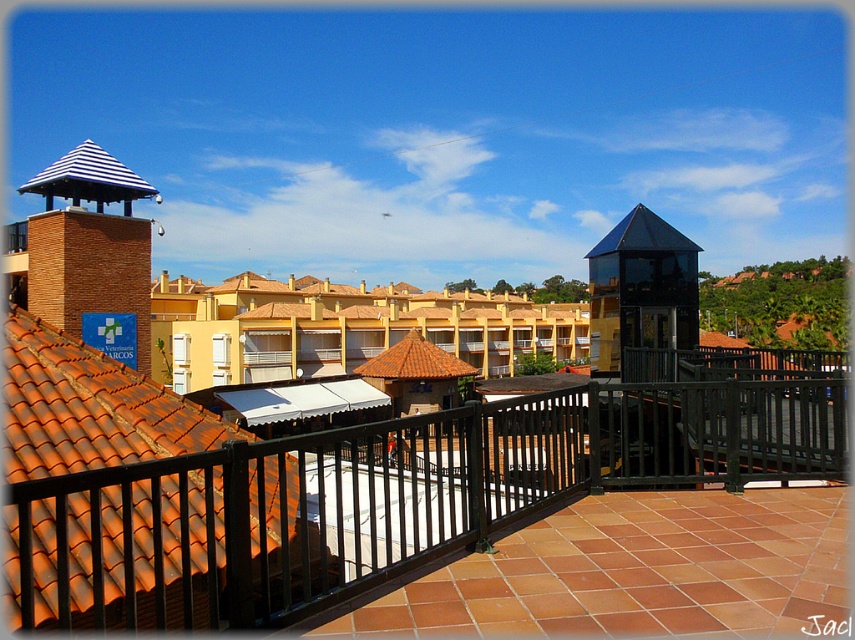
Question: Is brown tile roof at center to the right of shiny black roof at upper right from the viewer's perspective?

Choices:
 (A) no
 (B) yes

Answer: (A)

Question: Among these objects, which one is nearest to the camera?

Choices:
 (A) black metal railing at lower left
 (B) transparent glass bell tower at upper center

Answer: (A)

Question: Considering the relative positions of black metal railing at lower left and brown tile roof at center in the image provided, where is black metal railing at lower left located with respect to brown tile roof at center?

Choices:
 (A) left
 (B) right

Answer: (B)

Question: Estimate the real-world distances between objects in this image. Which object is closer to the brick bell tower at left?

Choices:
 (A) orange tile roof at upper left
 (B) transparent glass bell tower at upper center
 (C) shiny black roof at upper right

Answer: (B)

Question: Does brown tile roof at center have a smaller size compared to shiny black roof at upper right?

Choices:
 (A) yes
 (B) no

Answer: (A)

Question: Among these objects, which one is nearest to the camera?

Choices:
 (A) blue and white striped roof at upper left
 (B) transparent glass bell tower at upper center
 (C) brick bell tower at left

Answer: (B)